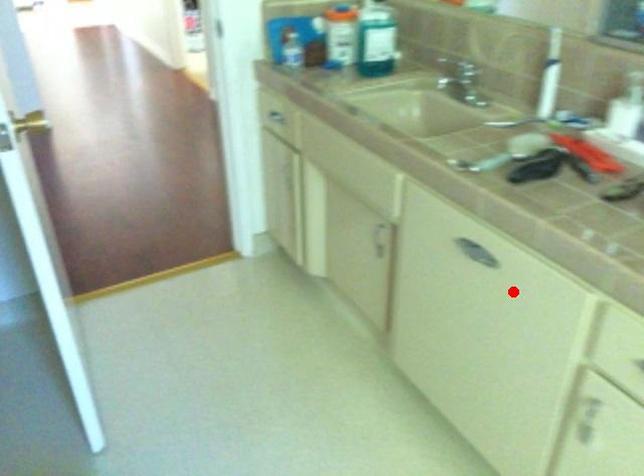
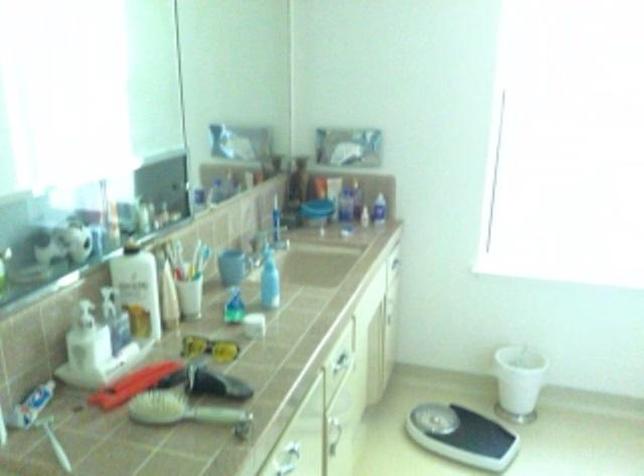
In the second image, find the point that corresponds to the highlighted location in the first image.

(290, 455)